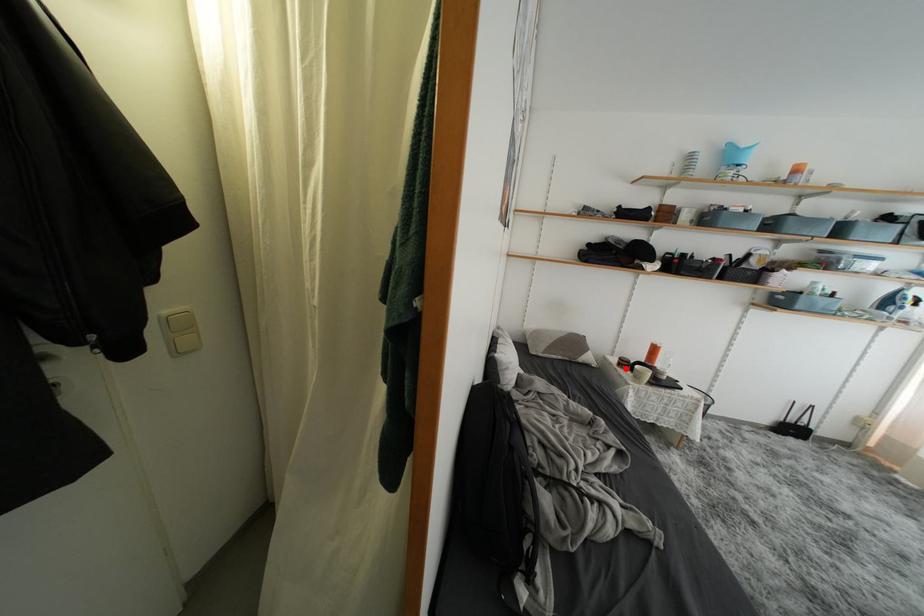
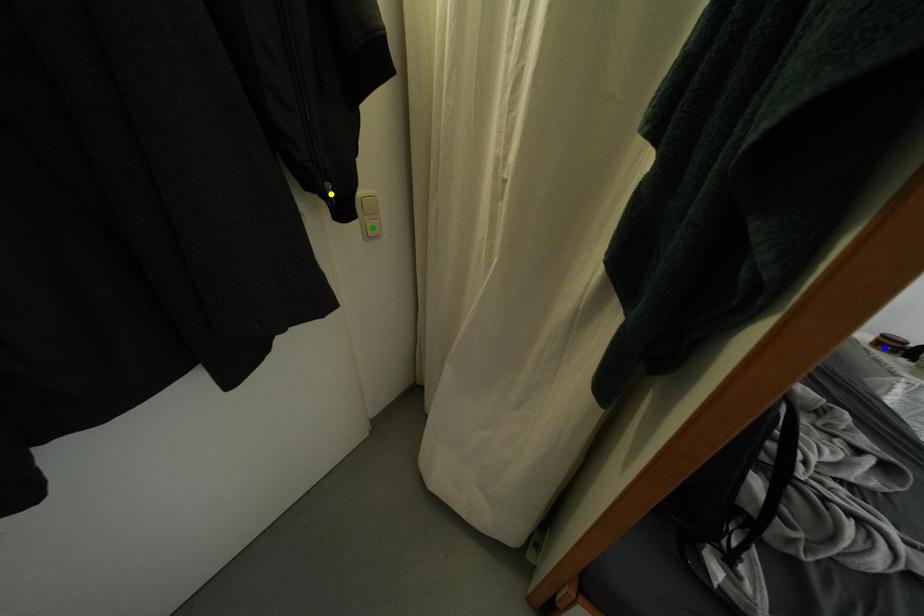
Question: I am providing you with two images of the same scene from different viewpoints. A red point is marked on the first image. You are given multiple points on the second image. Which point in image 2 represents the same 3d spot as the red point in image 1?

Choices:
 (A) blue point
 (B) green point
 (C) yellow point

Answer: (A)